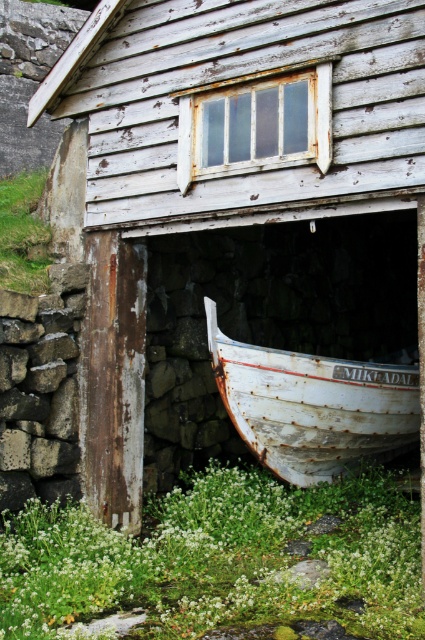
Is point (136, 589) closer to camera compared to point (235, 372)?

Yes.

Does green leafy weed at lower center appear over rusty white boat at lower center?

No.

Is point (419, 573) behind point (359, 401)?

That is False.

Where is `green leafy weed at lower center`? green leafy weed at lower center is located at coordinates point(223,561).